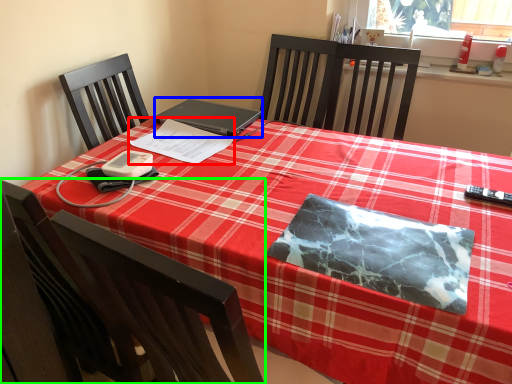
Question: Which object is the farthest from notebook (highlighted by a red box)? Choose among these: laptop (highlighted by a blue box) or chair (highlighted by a green box).

Choices:
 (A) laptop
 (B) chair

Answer: (B)